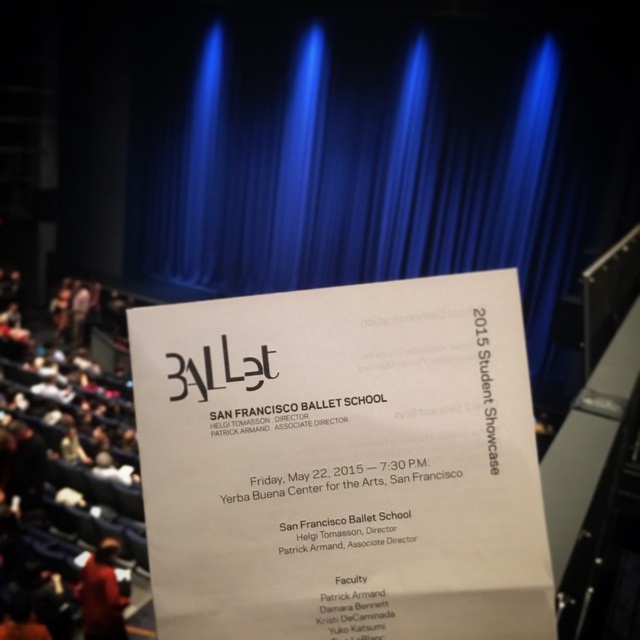
You are standing in front of the invitation card for the 2015 Student Showcase. There are two points marked on the card. The first point is at coordinates point (480, 134) and the second is at point (115, 589). From your perspective, which point is closer to you?

Point (115, 589) is closer to you because point (480, 134) is behind it.

You are an event planner organizing the 2015 Student Showcase. You need to place a decorative ribbon on the white paper at center and the blue velvet curtain at center. Which object requires a longer ribbon to cover its width?

The blue velvet curtain at center requires a longer ribbon because the white paper at center is thinner, meaning the curtain is wider.